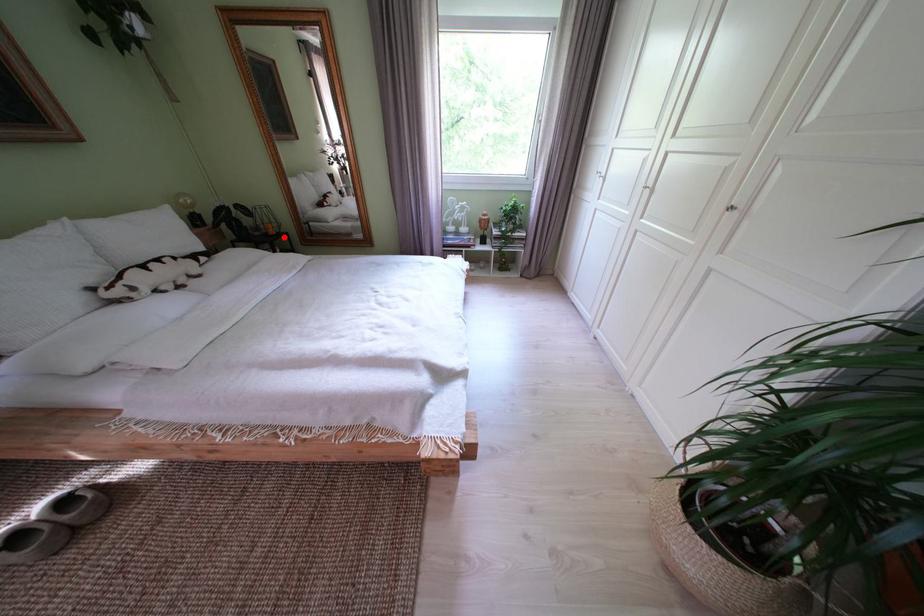
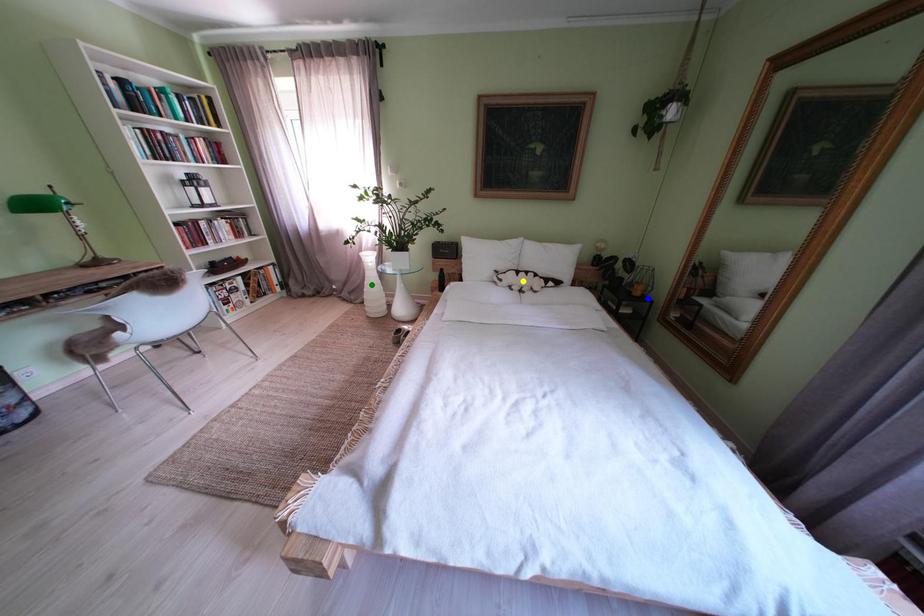
Question: I am providing you with two images of the same scene from different viewpoints. A red point is marked on the first image. You are given multiple points on the second image. Which point in image 2 represents the same 3d spot as the red point in image 1?

Choices:
 (A) green point
 (B) blue point
 (C) yellow point

Answer: (B)